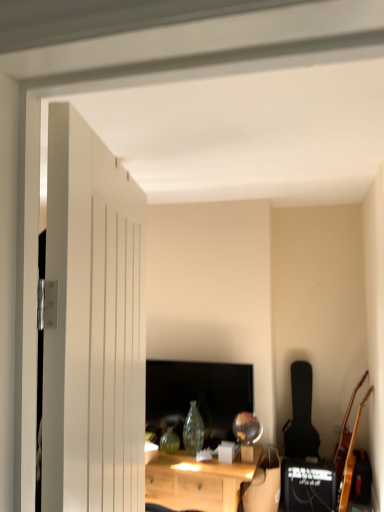
What is the approximate width of black matte guitar at right, the first guitar from the left?

The width of black matte guitar at right, the first guitar from the left, is 10.06 inches.

The image size is (384, 512). Identify the location of white wooden door at left. (93, 325).

In order to face wooden acoustic guitar at right, arranged as the second guitar when viewed from the back, should I rotate leftwards or rightwards?

To align with it, rotate right about 21.041°.

The image size is (384, 512). I want to click on wooden acoustic guitar at right, arranged as the second guitar when viewed from the back, so click(x=347, y=450).

This screenshot has width=384, height=512. I want to click on matte black monitor at center, so click(197, 396).

Does matte black monitor at center appear on the right side of black matte speaker at lower right?

No, matte black monitor at center is not to the right of black matte speaker at lower right.

Locate an element on the screen. speaker in front of the matte black monitor at center is located at coordinates (308, 486).

Who is shorter, matte black monitor at center or black matte speaker at lower right?

Standing shorter between the two is black matte speaker at lower right.

Is matte black monitor at center next to black matte speaker at lower right and touching it?

They are not placed beside each other.

Considering the sizes of objects black matte speaker at lower right and black matte guitar at right, placed as the 2th guitar when sorted from front to back, in the image provided, who is wider, black matte speaker at lower right or black matte guitar at right, placed as the 2th guitar when sorted from front to back,?

black matte speaker at lower right.

Which point is more forward, (324, 475) or (319, 438)?

The point (324, 475) is more forward.

From a real-world perspective, which object rests below the other?

black matte speaker at lower right, from a real-world perspective.

Does black matte speaker at lower right have a larger size compared to black matte guitar at right, the first guitar from the left?

Actually, black matte speaker at lower right might be smaller than black matte guitar at right, the first guitar from the left.

Are white wooden door at left and matte black monitor at center located far from each other?

Absolutely, white wooden door at left is distant from matte black monitor at center.

Looking at this image, relative to matte black monitor at center, is white wooden door at left in front or behind?

Clearly, white wooden door at left is in front of matte black monitor at center.

In terms of width, does white wooden door at left look wider or thinner when compared to matte black monitor at center?

In the image, white wooden door at left appears to be more narrow than matte black monitor at center.

Which point is more forward, (117, 429) or (179, 396)?

The point (117, 429) is closer to the camera.

In the scene shown: From a real-world perspective, between white wooden door at left and light wood desk at center, who is vertically higher?

white wooden door at left is physically above.

Considering the sizes of objects white wooden door at left and light wood desk at center in the image provided, who is wider, white wooden door at left or light wood desk at center?

light wood desk at center.

Is white wooden door at left facing towards light wood desk at center?

No, white wooden door at left is not facing towards light wood desk at center.

Which is in front, white wooden door at left or light wood desk at center?

white wooden door at left is in front.

Considering the relative positions of white wooden door at left and black matte guitar at right, the first guitar from the left, in the image provided, is white wooden door at left in front of black matte guitar at right, the first guitar from the left,?

Yes, white wooden door at left is closer to the viewer.

Is white wooden door at left oriented away from black matte guitar at right, the 1th guitar when ordered from back to front?

No.

From a real-world perspective, is white wooden door at left positioned over black matte guitar at right, the 1th guitar when ordered from back to front, based on gravity?

Yes, from a real-world perspective, white wooden door at left is over black matte guitar at right, the 1th guitar when ordered from back to front

Would you say white wooden door at left contains black matte guitar at right, the first guitar from the left?

No, white wooden door at left does not contain black matte guitar at right, the first guitar from the left.

Which is closer to the camera, (293, 401) or (64, 216)?

Point (64, 216)

How different are the orientations of black matte guitar at right, the first guitar from the left, and white wooden door at left in degrees?

103 degrees separate the facing orientations of black matte guitar at right, the first guitar from the left, and white wooden door at left.

Find the location of a particular element. The width and height of the screenshot is (384, 512). door lying on the left of black matte guitar at right, the first guitar from the left is located at coordinates (93, 325).

Considering the positions of objects black matte guitar at right, the 1th guitar when ordered from back to front, and white wooden door at left in the image provided, who is in front, black matte guitar at right, the 1th guitar when ordered from back to front, or white wooden door at left?

white wooden door at left.

Is matte black monitor at center at the right side of white wooden door at left?

Correct, you'll find matte black monitor at center to the right of white wooden door at left.

From a real-world perspective, which is physically above, matte black monitor at center or white wooden door at left?

white wooden door at left, from a real-world perspective.

Which object is further away from the camera taking this photo, matte black monitor at center or white wooden door at left?

Positioned behind is matte black monitor at center.

Which is correct: matte black monitor at center is inside white wooden door at left, or outside of it?

matte black monitor at center is not inside white wooden door at left, it's outside.

The width and height of the screenshot is (384, 512). I want to click on speaker on the right side of matte black monitor at center, so click(308, 486).

The height and width of the screenshot is (512, 384). Identify the location of speaker below the black matte guitar at right, the 1th guitar when ordered from back to front (from a real-world perspective). (308, 486).

Based on their spatial positions, is black matte guitar at right, placed as the 2th guitar when sorted from right to left, or matte black monitor at center further from light wood desk at center?

Among the two, black matte guitar at right, placed as the 2th guitar when sorted from right to left, is located further to light wood desk at center.

Consider the image. Based on their spatial positions, is white wooden door at left or wooden acoustic guitar at right, the 2th guitar from the left, closer to black matte speaker at lower right?

wooden acoustic guitar at right, the 2th guitar from the left, lies closer to black matte speaker at lower right than the other object.

Which object lies nearer to the anchor point black matte guitar at right, placed as the 2th guitar when sorted from front to back, white wooden door at left or matte black monitor at center?

matte black monitor at center is closer to black matte guitar at right, placed as the 2th guitar when sorted from front to back.

Which object lies further to the anchor point matte black monitor at center, black matte guitar at right, the first guitar from the left, or light wood desk at center?

black matte guitar at right, the first guitar from the left, lies further to matte black monitor at center than the other object.

From the image, which object appears to be farther from white wooden door at left, black matte guitar at right, placed as the 2th guitar when sorted from right to left, or matte black monitor at center?

black matte guitar at right, placed as the 2th guitar when sorted from right to left.

Which object lies nearer to the anchor point white wooden door at left, matte black monitor at center or light wood desk at center?

Based on the image, light wood desk at center appears to be nearer to white wooden door at left.

From the image, which object appears to be nearer to black matte guitar at right, placed as the 2th guitar when sorted from right to left, wooden acoustic guitar at right, arranged as the second guitar when viewed from the back, or white wooden door at left?

The object closer to black matte guitar at right, placed as the 2th guitar when sorted from right to left, is wooden acoustic guitar at right, arranged as the second guitar when viewed from the back.

From the image, which object appears to be farther from black matte guitar at right, placed as the 2th guitar when sorted from front to back, matte black monitor at center or wooden acoustic guitar at right, the 1th guitar positioned from the right?

matte black monitor at center is further to black matte guitar at right, placed as the 2th guitar when sorted from front to back.

The height and width of the screenshot is (512, 384). I want to click on speaker located between white wooden door at left and matte black monitor at center in the depth direction, so click(308, 486).

At what (x,y) coordinates should I click in order to perform the action: click on speaker located between matte black monitor at center and wooden acoustic guitar at right, arranged as the second guitar when viewed from the back, in the left-right direction. Please return your answer as a coordinate pair (x, y). This screenshot has height=512, width=384. Looking at the image, I should click on (308, 486).

You are a GUI agent. You are given a task and a screenshot of the screen. Output one action in this format:
    pyautogui.click(x=<x>, y=<y>)
    Task: Click on the desk between white wooden door at left and matte black monitor at center from front to back
    Image resolution: width=384 pixels, height=512 pixels.
    Given the screenshot: What is the action you would take?
    tap(197, 482)

This screenshot has height=512, width=384. What are the coordinates of `guitar between white wooden door at left and black matte guitar at right, the first guitar from the left, along the z-axis` in the screenshot? It's located at (347, 450).